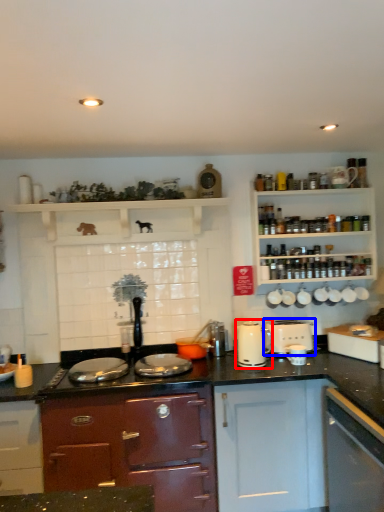
Question: Which object appears closest to the camera in this image, kitchen appliance (highlighted by a red box) or toaster (highlighted by a blue box)?

Choices:
 (A) kitchen appliance
 (B) toaster

Answer: (A)